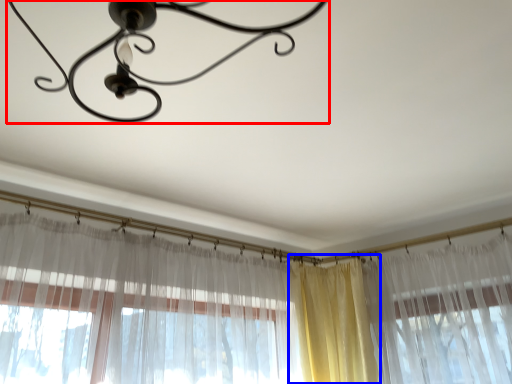
Question: Among these objects, which one is nearest to the camera, lamp (highlighted by a red box) or curtain (highlighted by a blue box)?

Choices:
 (A) lamp
 (B) curtain

Answer: (A)